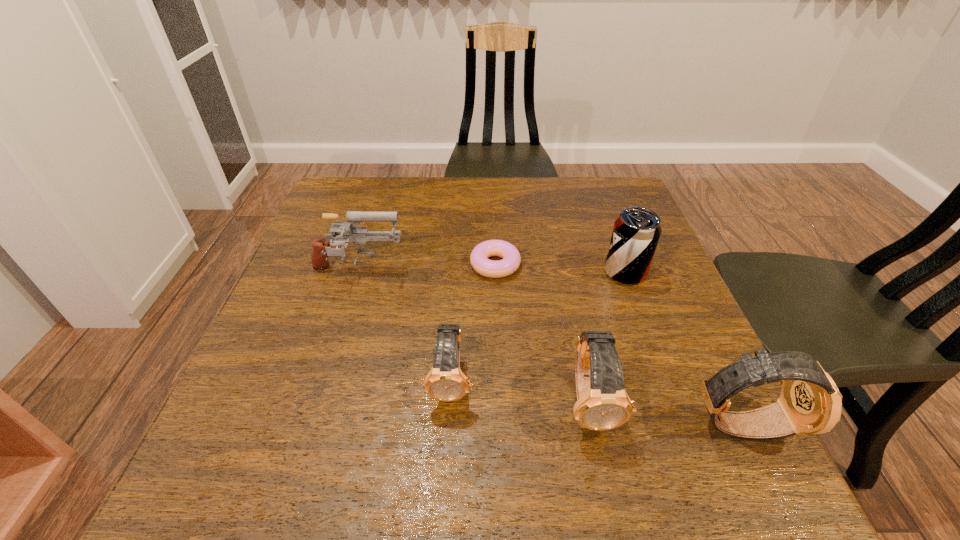
Identify the location of free space that is in between the third object from right to left and the fifth tallest object. This screenshot has width=960, height=540. (521, 392).

Where is `object that can be found as the closest to the shortest watch`? The width and height of the screenshot is (960, 540). object that can be found as the closest to the shortest watch is located at coordinates (602, 403).

At what (x,y) coordinates should I click in order to perform the action: click on the third closest object to the leftmost object. Please return your answer as a coordinate pair (x, y). Looking at the image, I should click on (602, 403).

Identify the location of the second closest watch relative to the gun. Image resolution: width=960 pixels, height=540 pixels. (602, 403).

Point out which watch is positioned as the nearest to the soda can. Please provide its 2D coordinates. Your answer should be formatted as a tuple, i.e. [(x, y)], where the tuple contains the x and y coordinates of a point satisfying the conditions above.

[(602, 403)]